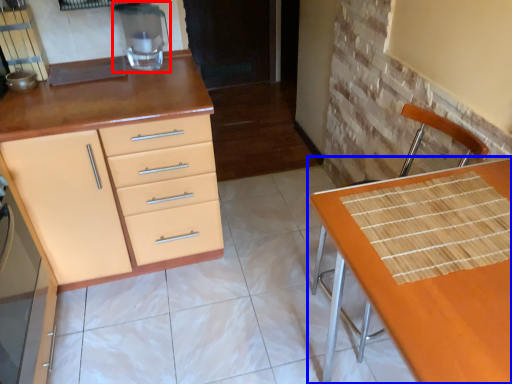
Question: Which of the following is the farthest to the observer, appliance (highlighted by a red box) or table (highlighted by a blue box)?

Choices:
 (A) appliance
 (B) table

Answer: (A)